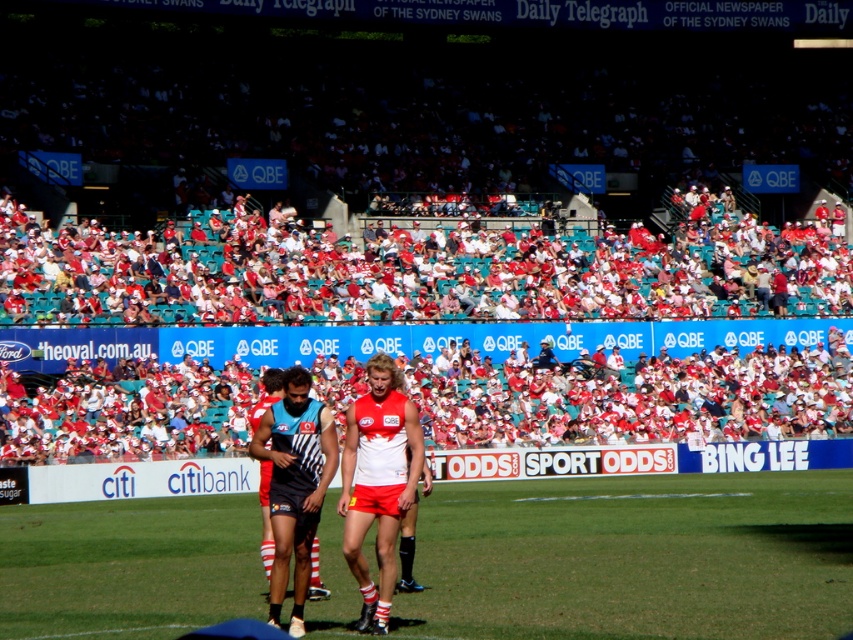
Does red jersey at center have a lesser width compared to matte black uniform at center?

No.

Describe the element at coordinates (378, 483) in the screenshot. I see `red jersey at center` at that location.

The height and width of the screenshot is (640, 853). Find the location of `red jersey at center`. red jersey at center is located at coordinates [x=378, y=483].

At what (x,y) coordinates should I click in order to perform the action: click on red jersey at center. Please return your answer as a coordinate pair (x, y). The image size is (853, 640). Looking at the image, I should click on (378, 483).

Between green grass at center and red jersey at center, which one is positioned higher?

Positioned higher is red jersey at center.

Is point (589, 516) farther from viewer compared to point (399, 394)?

Yes, it is behind point (399, 394).

This screenshot has height=640, width=853. What do you see at coordinates (635, 557) in the screenshot? I see `green grass at center` at bounding box center [635, 557].

Identify the location of green grass at center. (635, 557).

Is point (746, 614) positioned behind point (305, 468)?

That is False.

Where is `green grass at center`? This screenshot has height=640, width=853. green grass at center is located at coordinates (635, 557).